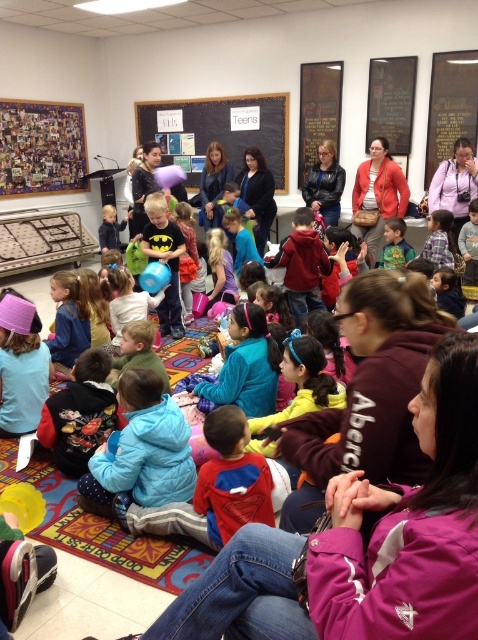
You are standing in the room and want to move from the point at coordinates (383,172) to the point at (173,282). Which direction should you move in to get closer to the latter point?

To move from point (383,172) to point (173,282), you should move downward and to the right since point (173,282) is located below and to the right of point (383,172).

Consider the image. You are a photographer standing at the front of the room where the children are sitting. You want to take a photo that includes both the blue fleece jacket at lower center and the matte red jacket at upper right. Considering their positions, will both jackets be visible in the same frame?

The blue fleece jacket at lower center is 4.11 meters away from the matte red jacket at upper right. Since the distance between them is significant, it is possible to include both in the same frame if the camera has a wide enough angle or if you position yourself appropriately to capture the entire space between them.